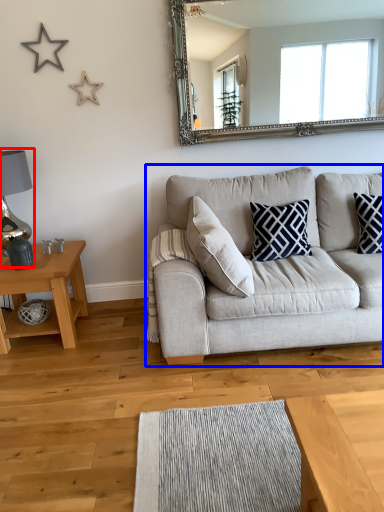
Question: Among these objects, which one is farthest to the camera, lamp (highlighted by a red box) or studio couch (highlighted by a blue box)?

Choices:
 (A) lamp
 (B) studio couch

Answer: (A)